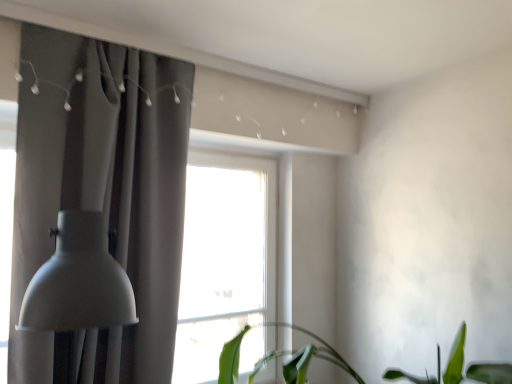
Question: Is matte gray curtain at left taller or shorter than green leafy plant at lower center?

Choices:
 (A) tall
 (B) short

Answer: (A)

Question: In the image, is matte gray curtain at left positioned in front of or behind green leafy plant at lower center?

Choices:
 (A) front
 (B) behind

Answer: (B)

Question: Based on their relative distances, which object is farther from the green leafy plant at lower center?

Choices:
 (A) matte gray lampshade at left
 (B) matte gray curtain at left

Answer: (A)

Question: Which of these objects is positioned farthest from the matte gray lampshade at left?

Choices:
 (A) green leafy plant at lower center
 (B) matte gray curtain at left

Answer: (A)